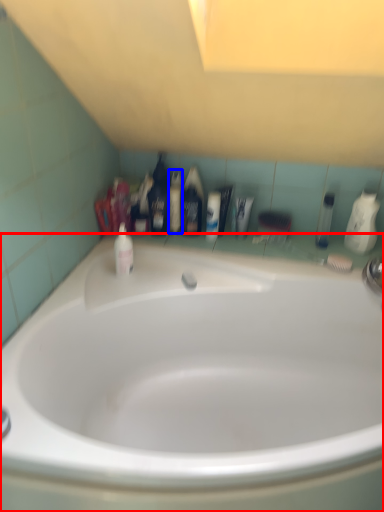
Question: Which object is further to the camera taking this photo, bathtub (highlighted by a red box) or mouthwash (highlighted by a blue box)?

Choices:
 (A) bathtub
 (B) mouthwash

Answer: (B)